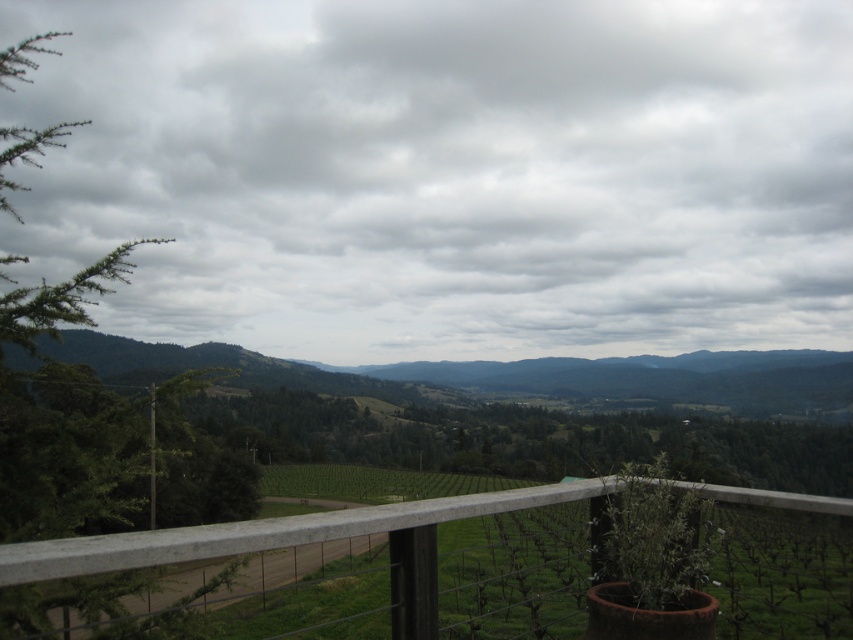
Is point (827, 195) farther from camera compared to point (90, 272)?

Yes, point (827, 195) is farther from viewer.

Locate an element on the screen. The height and width of the screenshot is (640, 853). cloudy sky at upper center is located at coordinates (450, 173).

Which is behind, point (334, 4) or point (68, 314)?

Positioned behind is point (334, 4).

At what (x,y) coordinates should I click in order to perform the action: click on cloudy sky at upper center. Please return your answer as a coordinate pair (x, y). Looking at the image, I should click on (450, 173).

Measure the distance between white concrete fence at lower center and camera.

2.05 meters

Measure the distance between point (x=212, y=557) and camera.

7.45 feet

Does point (51, 550) come farther from viewer compared to point (125, 278)?

No, it is in front of (125, 278).

The width and height of the screenshot is (853, 640). What are the coordinates of `white concrete fence at lower center` in the screenshot? It's located at (294, 541).

Is cloudy sky at upper center bigger than white concrete fence at lower center?

Yes.

Is cloudy sky at upper center further to the viewer compared to white concrete fence at lower center?

That is True.

The height and width of the screenshot is (640, 853). I want to click on cloudy sky at upper center, so click(x=450, y=173).

Locate an element on the screen. The image size is (853, 640). cloudy sky at upper center is located at coordinates (450, 173).